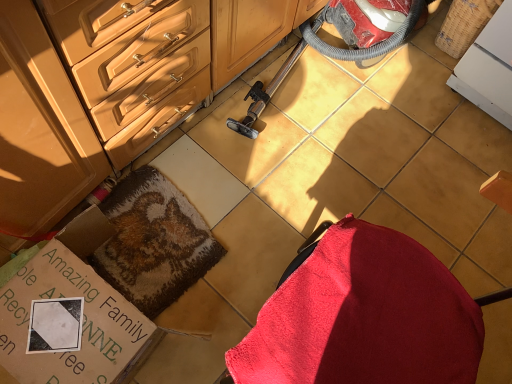
Identify the location of free point behind fluffy brown rug at center. (208, 155).